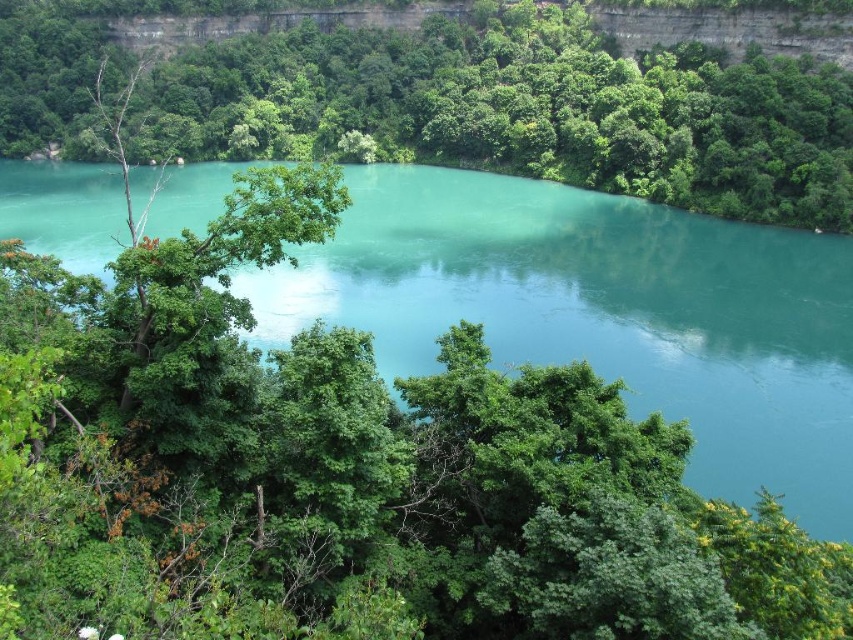
Question: Which point appears farthest from the camera in this image?

Choices:
 (A) (389, 33)
 (B) (627, 323)

Answer: (A)

Question: Considering the relative positions of turquoise glossy water at center and green leafy tree at center in the image provided, where is turquoise glossy water at center located with respect to green leafy tree at center?

Choices:
 (A) left
 (B) right

Answer: (B)

Question: Where is turquoise glossy water at center located in relation to green leafy tree at center in the image?

Choices:
 (A) left
 (B) right

Answer: (B)

Question: Is turquoise glossy water at center above green leafy tree at center?

Choices:
 (A) no
 (B) yes

Answer: (A)

Question: Which of the following is the farthest from the observer?

Choices:
 (A) green leafy tree at center
 (B) turquoise glossy water at center

Answer: (A)